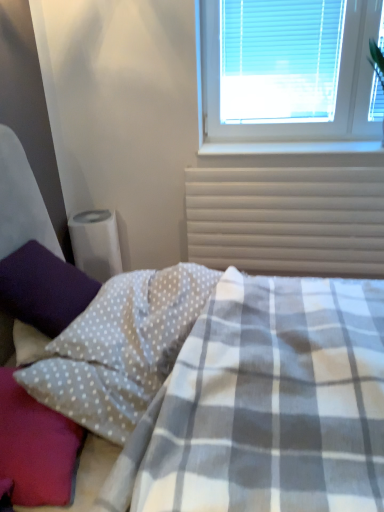
Question: Is white plastic radiator at upper right aimed at white dotted fabric pillow at lower left, which ranks as the third pillow in left-to-right order?

Choices:
 (A) no
 (B) yes

Answer: (B)

Question: Does white plastic radiator at upper right have a smaller size compared to white dotted fabric pillow at lower left, the first pillow positioned from the right?

Choices:
 (A) yes
 (B) no

Answer: (A)

Question: Is white plastic radiator at upper right placed right next to white dotted fabric pillow at lower left, the first pillow positioned from the right?

Choices:
 (A) no
 (B) yes

Answer: (A)

Question: Is white plastic radiator at upper right further to camera compared to white dotted fabric pillow at lower left, the first pillow positioned from the right?

Choices:
 (A) yes
 (B) no

Answer: (A)

Question: Is white plastic radiator at upper right at the left side of white dotted fabric pillow at lower left, the first pillow positioned from the right?

Choices:
 (A) no
 (B) yes

Answer: (A)

Question: Is white plastic radiator at upper right oriented away from white dotted fabric pillow at lower left, which ranks as the third pillow in left-to-right order?

Choices:
 (A) no
 (B) yes

Answer: (A)

Question: Is the depth of white dotted fabric pillow at lower left, the second pillow positioned from the left, less than that of purple fuzzy pillow at left, which is the first pillow from left to right?

Choices:
 (A) no
 (B) yes

Answer: (B)

Question: Considering the relative sizes of white dotted fabric pillow at lower left, acting as the second pillow starting from the right, and purple fuzzy pillow at left, which is the first pillow from left to right, in the image provided, is white dotted fabric pillow at lower left, acting as the second pillow starting from the right, wider than purple fuzzy pillow at left, which is the first pillow from left to right,?

Choices:
 (A) no
 (B) yes

Answer: (A)

Question: Does white dotted fabric pillow at lower left, the second pillow positioned from the left, have a lesser width compared to purple fuzzy pillow at left, the third pillow when ordered from right to left?

Choices:
 (A) no
 (B) yes

Answer: (B)

Question: Is white dotted fabric pillow at lower left, the second pillow positioned from the left, facing away from purple fuzzy pillow at left, the third pillow when ordered from right to left?

Choices:
 (A) no
 (B) yes

Answer: (A)

Question: Would you say white dotted fabric pillow at lower left, the second pillow positioned from the left, is outside purple fuzzy pillow at left, the third pillow when ordered from right to left?

Choices:
 (A) yes
 (B) no

Answer: (A)

Question: Is white dotted fabric pillow at lower left, the second pillow positioned from the left, smaller than purple fuzzy pillow at left, the third pillow when ordered from right to left?

Choices:
 (A) no
 (B) yes

Answer: (B)

Question: Is purple fuzzy pillow at left, the third pillow when ordered from right to left, positioned before white plastic blinds at upper right?

Choices:
 (A) yes
 (B) no

Answer: (A)